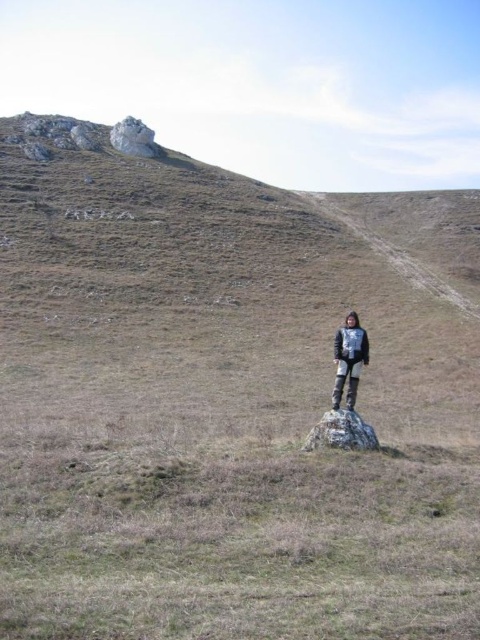
Question: Is gray fabric jacket at center positioned in front of white rocky peak at upper left?

Choices:
 (A) no
 (B) yes

Answer: (B)

Question: Which object is the farthest from the gray rough rock at center?

Choices:
 (A) white rocky peak at upper left
 (B) gray fabric jacket at center

Answer: (A)

Question: Is the position of gray fabric jacket at center more distant than that of gray rough rock at center?

Choices:
 (A) yes
 (B) no

Answer: (A)

Question: Can you confirm if gray rough rock at center is positioned to the right of white rocky peak at upper left?

Choices:
 (A) yes
 (B) no

Answer: (A)

Question: Which is nearer to the gray rough rock at center?

Choices:
 (A) white rocky peak at upper left
 (B) gray fabric jacket at center

Answer: (B)

Question: Which point is closer to the camera?

Choices:
 (A) (328, 445)
 (B) (149, 145)
 (C) (348, 349)

Answer: (A)